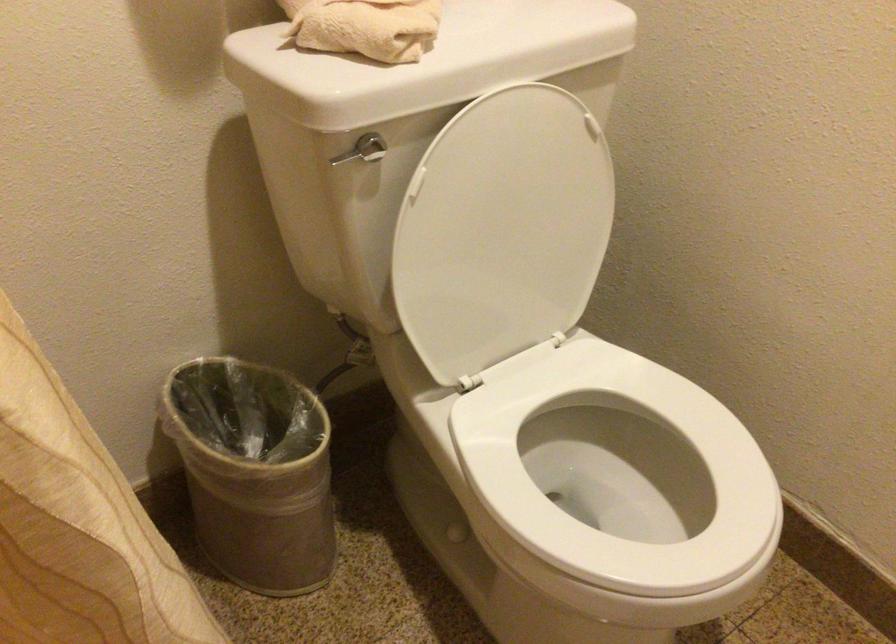
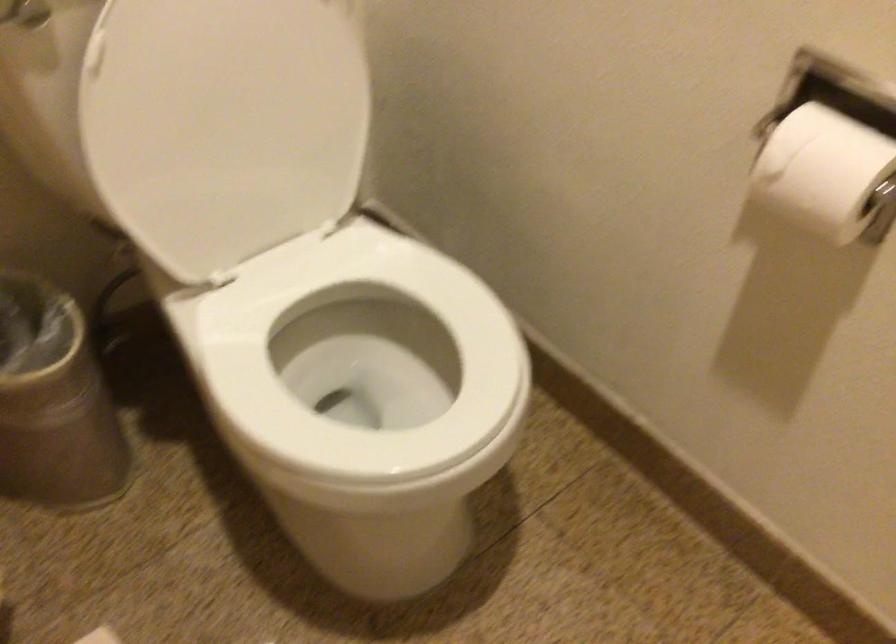
Question: The images are taken continuously from a first-person perspective. In which direction is your viewpoint rotating?

Choices:
 (A) Left
 (B) Right
 (C) Up
 (D) Down

Answer: (D)